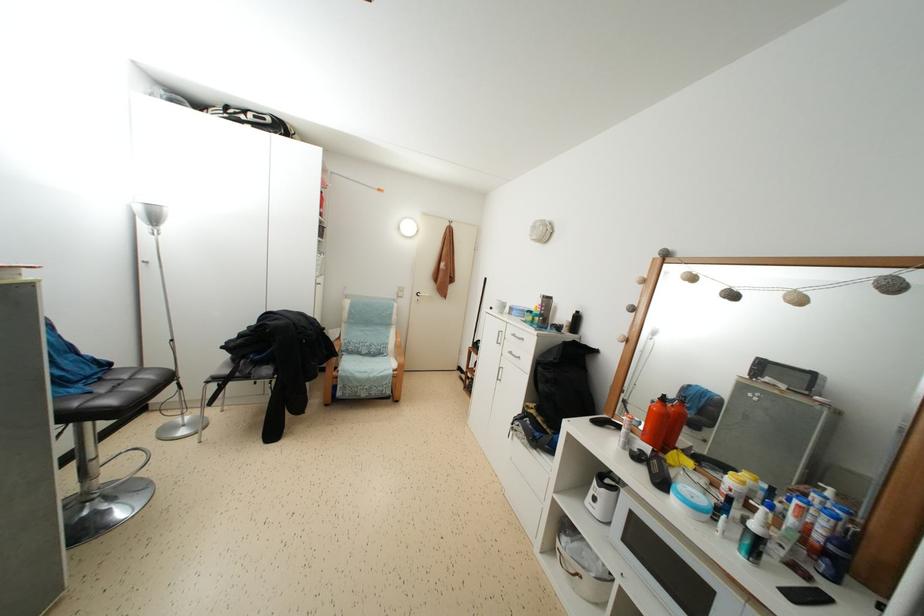
Locate an element on the screen. The width and height of the screenshot is (924, 616). black chair sitting surface is located at coordinates (113, 394).